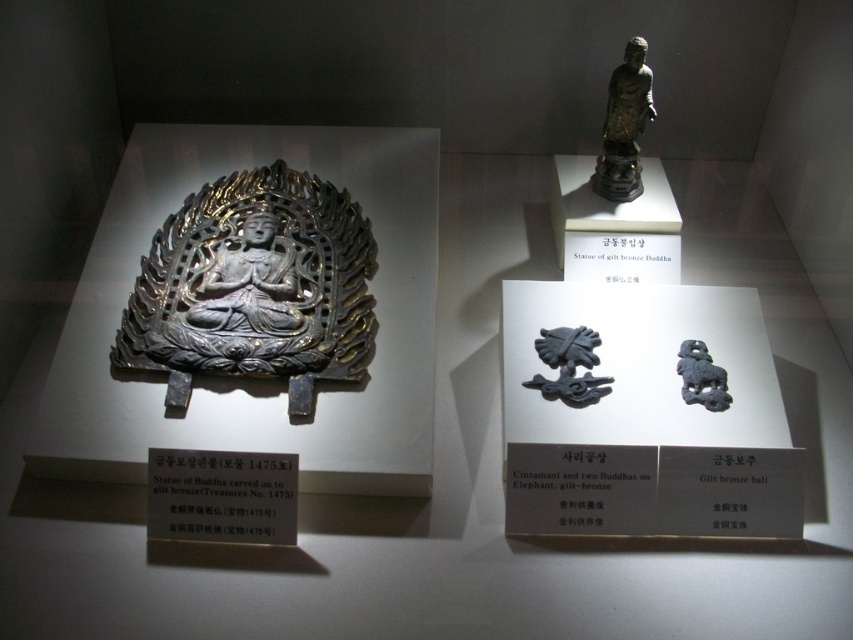
You are a museum visitor standing in front of the display case. You notice two points marked on the glass. The first point is labeled as point (155, 291) and the second as point (699, 400). According to the description, which point is closer to you?

Point (699, 400) is closer to you because it is in front of point (155, 291).

You are a museum visitor who wants to take a photo of both the gilt bronze plaque at center and the gilt bronze buddha at upper right. However, your camera can only focus on one object at a time. Which object should you focus on first to ensure the other is still in the frame?

You should focus on the gilt bronze buddha at upper right first because the gilt bronze plaque at center is positioned under it, meaning the plaque will remain in the frame when focusing on the higher object.